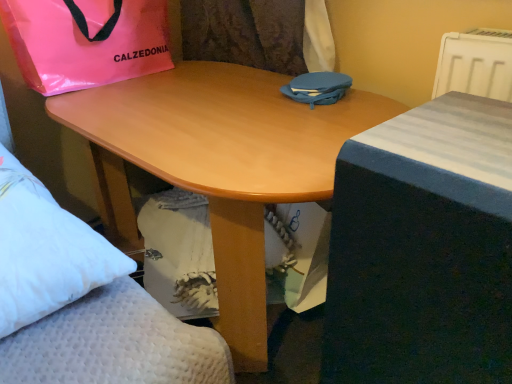
Question: Should I look upward or downward to see blue fabric bag at center, acting as the 2th bag starting from the left?

Choices:
 (A) up
 (B) down

Answer: (A)

Question: Considering the relative sizes of blue fabric bed at right and blue fabric bag at center, acting as the 2th bag starting from the left, in the image provided, is blue fabric bed at right shorter than blue fabric bag at center, acting as the 2th bag starting from the left,?

Choices:
 (A) no
 (B) yes

Answer: (A)

Question: Considering the relative sizes of blue fabric bed at right and blue fabric bag at center, placed as the 1th bag when sorted from right to left, in the image provided, is blue fabric bed at right smaller than blue fabric bag at center, placed as the 1th bag when sorted from right to left,?

Choices:
 (A) yes
 (B) no

Answer: (B)

Question: From a real-world perspective, is blue fabric bed at right positioned over blue fabric bag at center, placed as the 1th bag when sorted from right to left, based on gravity?

Choices:
 (A) no
 (B) yes

Answer: (A)

Question: Can you see blue fabric bed at right touching blue fabric bag at center, placed as the 1th bag when sorted from right to left?

Choices:
 (A) yes
 (B) no

Answer: (B)

Question: Would you consider blue fabric bed at right to be distant from blue fabric bag at center, acting as the 2th bag starting from the left?

Choices:
 (A) no
 (B) yes

Answer: (A)

Question: Can you confirm if blue fabric bed at right is taller than blue fabric bag at center, acting as the 2th bag starting from the left?

Choices:
 (A) yes
 (B) no

Answer: (A)

Question: Does light wood desk at center have a lesser height compared to pink plastic bag at upper left, placed as the second bag when sorted from right to left?

Choices:
 (A) yes
 (B) no

Answer: (B)

Question: From the image's perspective, does light wood desk at center appear higher than pink plastic bag at upper left, placed as the second bag when sorted from right to left?

Choices:
 (A) yes
 (B) no

Answer: (B)

Question: Does light wood desk at center have a smaller size compared to pink plastic bag at upper left, placed as the second bag when sorted from right to left?

Choices:
 (A) yes
 (B) no

Answer: (B)

Question: From a real-world perspective, is light wood desk at center located beneath pink plastic bag at upper left, which is the 1th bag in left-to-right order?

Choices:
 (A) yes
 (B) no

Answer: (A)

Question: Is pink plastic bag at upper left, which is the 1th bag in left-to-right order, surrounded by light wood desk at center?

Choices:
 (A) yes
 (B) no

Answer: (B)

Question: Does light wood desk at center have a lesser width compared to pink plastic bag at upper left, which is the 1th bag in left-to-right order?

Choices:
 (A) no
 (B) yes

Answer: (A)

Question: Considering the relative sizes of white plastic radiator at upper right and blue fabric bed at right in the image provided, is white plastic radiator at upper right thinner than blue fabric bed at right?

Choices:
 (A) no
 (B) yes

Answer: (B)